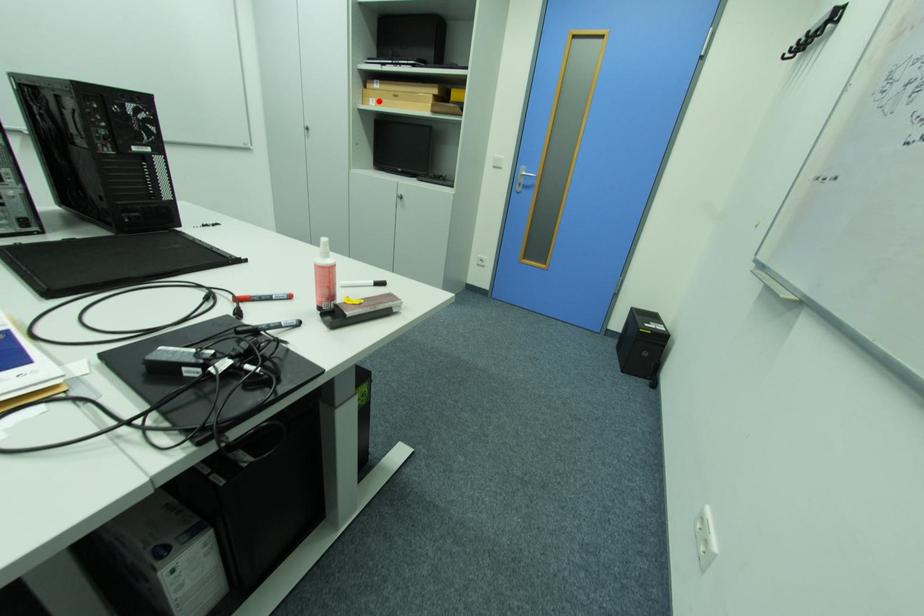
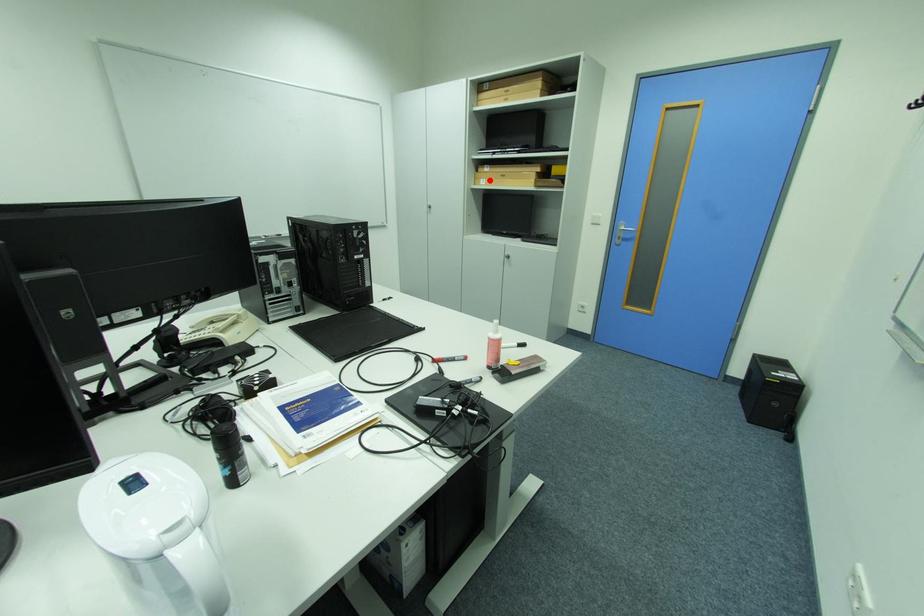
I am providing you with two images of the same scene from different viewpoints. A red point is marked on the first image and another point is marked on the second image. Are the points marked in image1 and image2 representing the same 3D position?

Yes